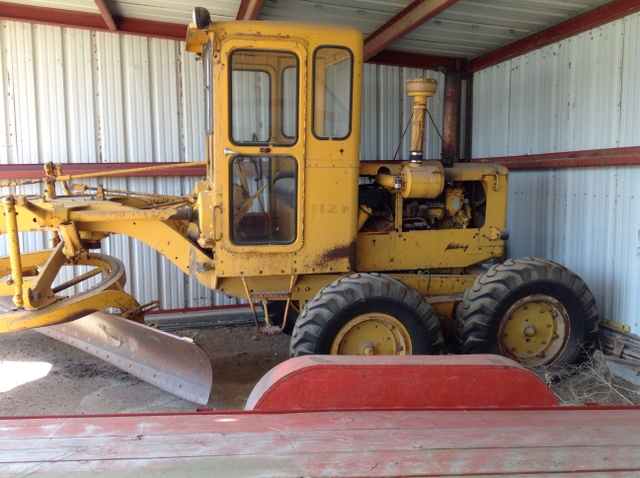
Where is `door handle`? The width and height of the screenshot is (640, 478). door handle is located at coordinates (224, 150).